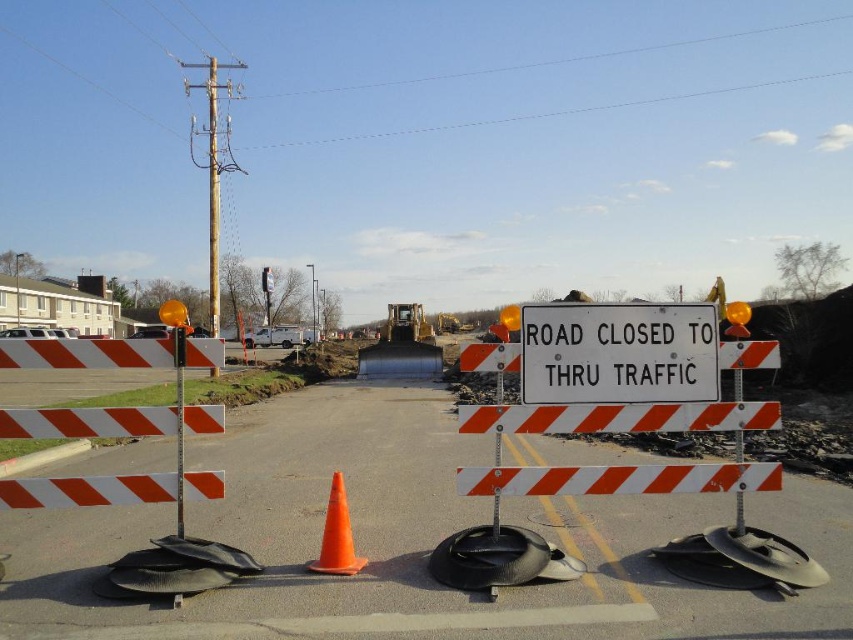
Consider the image. You are a delivery driver who needs to navigate through the construction site. The white reflective barricade at center is blocking your path. Can you describe the exact location of the barricade to reroute your vehicle?

The white reflective barricade at center is located at coordinates point (402, 540). You should reroute your vehicle around this point to avoid obstruction.

You are a delivery driver who needs to navigate around the construction site. You see a white plastic sign at center. Where exactly is the white plastic sign located in relation to the barricade and the orange traffic cone?

The white plastic sign at center is located at point [618,353], which places it centrally in the scene, likely between the barricade and the orange traffic cone, serving as a central reference point for navigation.